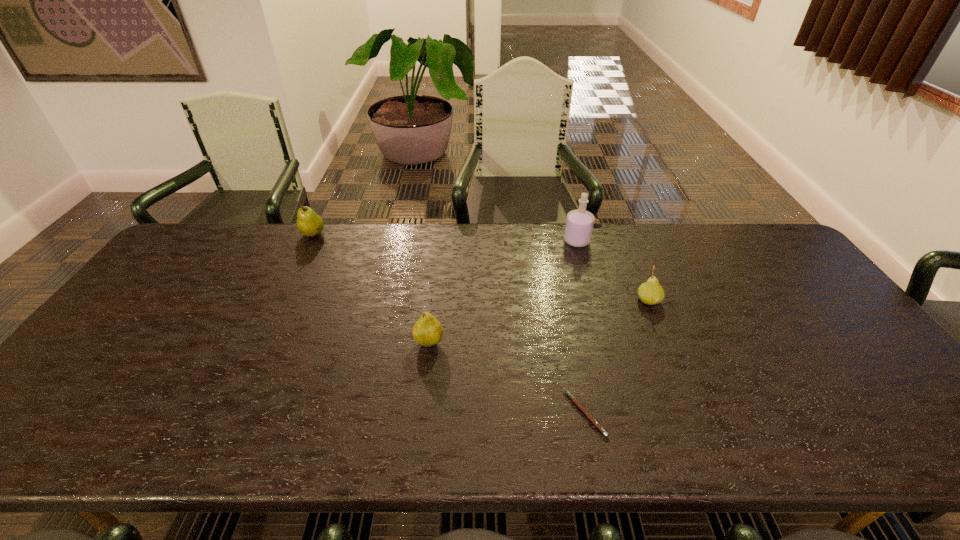
Where is `blank space that satisfies the following two spatial constraints: 1. on the front side of the rightmost pear; 2. on the right side of the second object from right to left`? blank space that satisfies the following two spatial constraints: 1. on the front side of the rightmost pear; 2. on the right side of the second object from right to left is located at coordinates (x=593, y=301).

The width and height of the screenshot is (960, 540). I want to click on vacant space that satisfies the following two spatial constraints: 1. on the back side of the tallest object; 2. on the right side of the nearest pear, so click(441, 241).